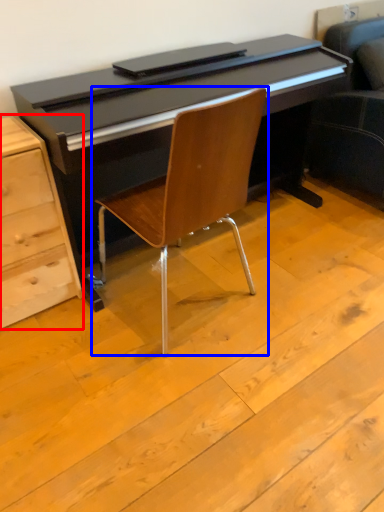
Question: Which of the following is the closest to the observer, chest of drawers (highlighted by a red box) or chair (highlighted by a blue box)?

Choices:
 (A) chest of drawers
 (B) chair

Answer: (B)